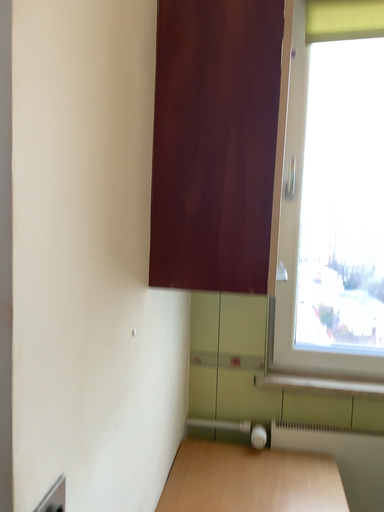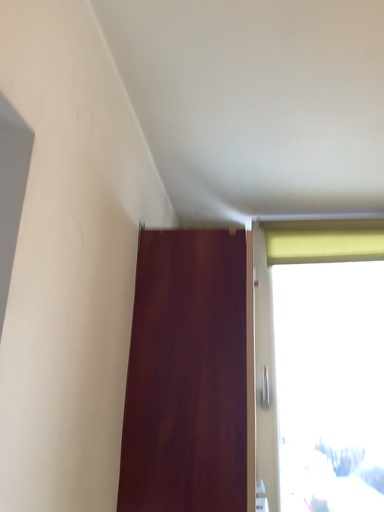
Question: How did the camera likely rotate when shooting the video?

Choices:
 (A) rotated downward
 (B) rotated upward

Answer: (B)